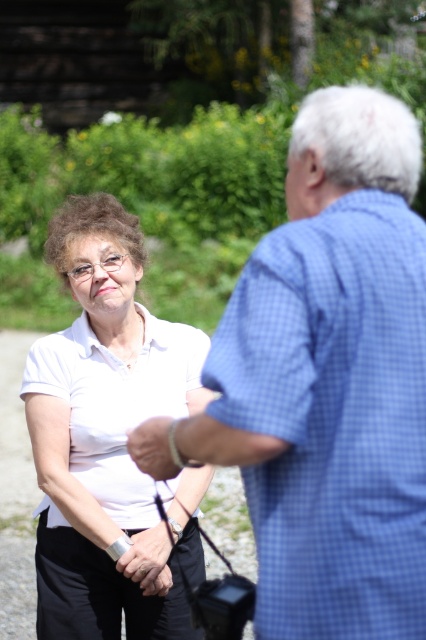
You are a photographer trying to capture a closeup of the matte black hand at center. Based on its position, would you need to adjust your camera focus to ensure clarity?

The matte black hand at center is located at point (147, 561), so you should adjust your camera focus to that coordinate for clarity.

You are a photographer trying to capture a closeup shot of the blue checkered shirt at upper right and the matte black hand at center. Which object should you zoom in more on to ensure both are in focus?

The blue checkered shirt at upper right is larger in size compared to the matte black hand at center, so you should zoom in more on the matte black hand at center to ensure both are in focus.